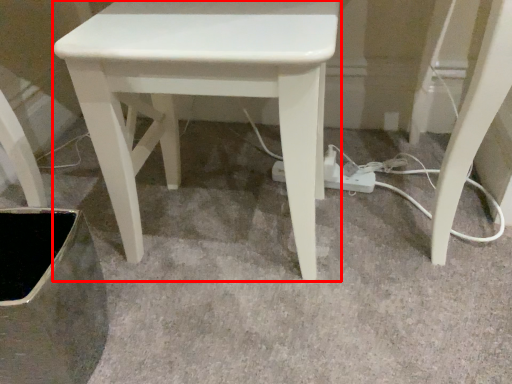
Question: Observing the image, what is the correct spatial positioning of stool (annotated by the red box) in reference to extension cord?

Choices:
 (A) right
 (B) left

Answer: (B)